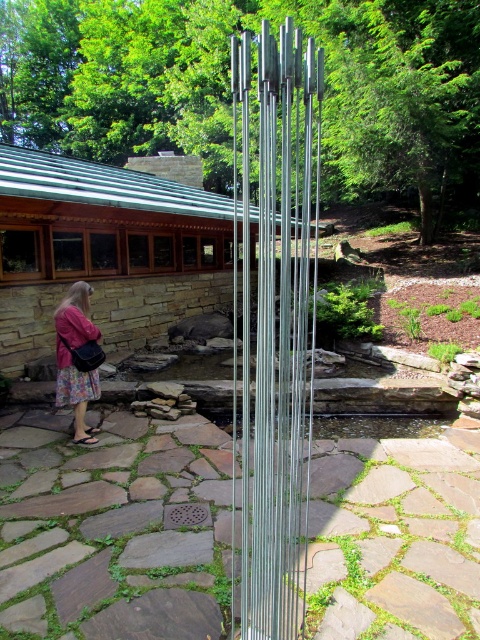
Which is in front, point (276, 154) or point (69, 324)?

Positioned in front is point (276, 154).

Is silver metallic wind chime at center wider than floral skirt at lower left?

Yes, silver metallic wind chime at center is wider than floral skirt at lower left.

Find the location of `silver metallic wind chime at center`. silver metallic wind chime at center is located at coordinates (276, 328).